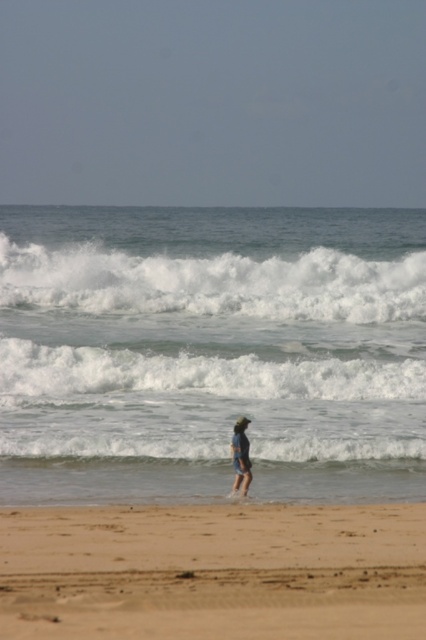
You are a photographer trying to capture the blue denim shorts at center and the white foamy water at center in a single frame. Based on the scene, which object occupies more horizontal space in the image?

The white foamy water at center occupies more horizontal space in the image because its width is larger than that of the blue denim shorts at center.

Looking at this image, you are a photographer trying to capture the white foamy water at center and the white foamy wave at center in one shot. Which of the two objects should you focus on first to ensure both are in frame?

You should focus on the white foamy water at center first since it is larger in size than the white foamy wave at center, ensuring it fits within the frame while still allowing space for the smaller wave.